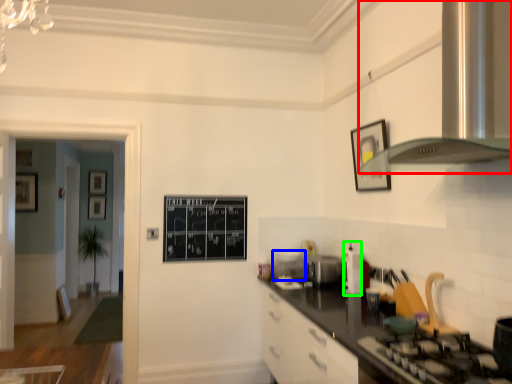
Question: Which object is the closest to the exhaust hood (highlighted by a red box)? Choose among these: appliance (highlighted by a blue box) or appliance (highlighted by a green box).

Choices:
 (A) appliance
 (B) appliance

Answer: (B)